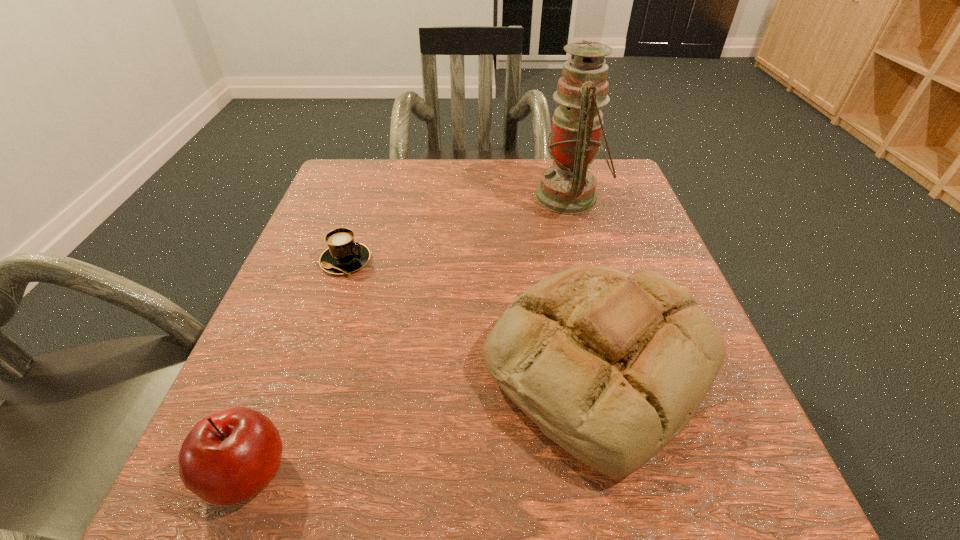
Locate an element on the screen. This screenshot has width=960, height=540. free space between the apple and the third nearest object is located at coordinates (297, 367).

Where is `empty space between the cappuccino and the third shortest object`? empty space between the cappuccino and the third shortest object is located at coordinates (472, 313).

Identify the location of free space between the tallest object and the apple. The width and height of the screenshot is (960, 540). (409, 335).

Find the location of a particular element. vacant space in between the shortest object and the second tallest object is located at coordinates [472, 313].

Locate an element on the screen. Image resolution: width=960 pixels, height=540 pixels. object that is the nearest to the third nearest object is located at coordinates [611, 366].

Choose which object is the third nearest neighbor to the bread. Please provide its 2D coordinates. Your answer should be formatted as a tuple, i.e. [(x, y)], where the tuple contains the x and y coordinates of a point satisfying the conditions above.

[(228, 457)]

This screenshot has height=540, width=960. I want to click on free space that satisfies the following two spatial constraints: 1. on the back side of the oil lamp; 2. on the right side of the third tallest object, so pos(353,197).

Find the location of a particular element. vacant space that satisfies the following two spatial constraints: 1. on the back side of the shortest object; 2. on the right side of the tallest object is located at coordinates (368, 197).

Where is `vacant region that satisfies the following two spatial constraints: 1. on the back side of the third tallest object; 2. on the right side of the third nearest object`? This screenshot has width=960, height=540. vacant region that satisfies the following two spatial constraints: 1. on the back side of the third tallest object; 2. on the right side of the third nearest object is located at coordinates [x=329, y=261].